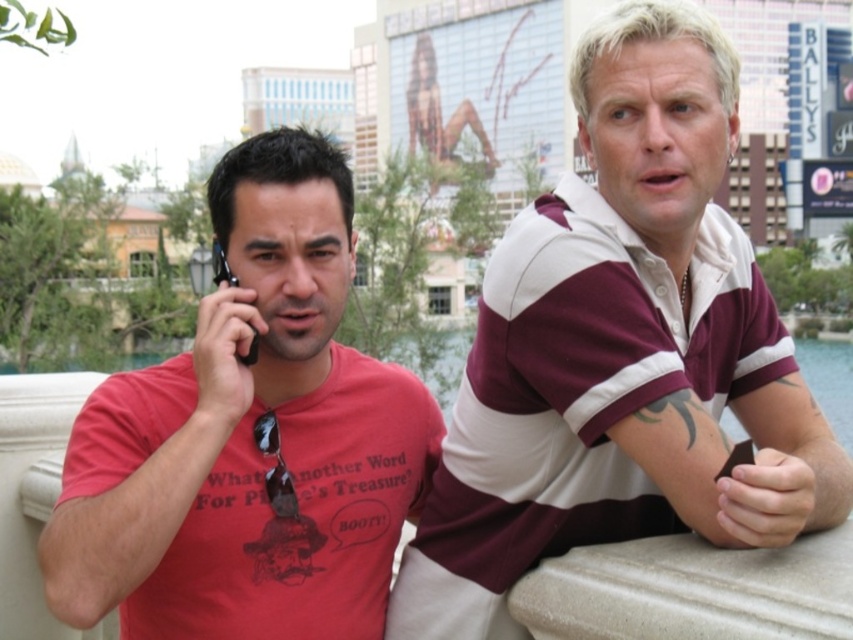
Based on the photo, between maroon striped polo shirt at center and matte red t-shirt at left, which one has more height?

Standing taller between the two is maroon striped polo shirt at center.

Between maroon striped polo shirt at center and matte red t-shirt at left, which one is positioned higher?

maroon striped polo shirt at center

The height and width of the screenshot is (640, 853). What are the coordinates of `maroon striped polo shirt at center` in the screenshot? It's located at (621, 349).

Identify the location of maroon striped polo shirt at center. Image resolution: width=853 pixels, height=640 pixels. (621, 349).